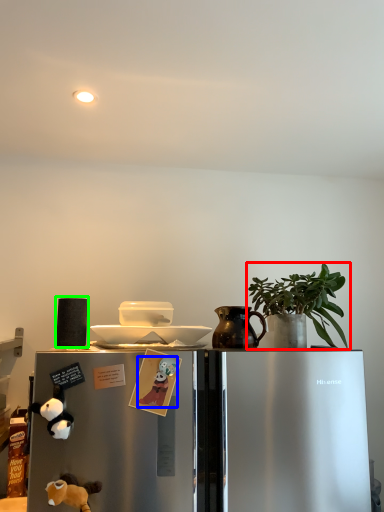
Question: Estimate the real-world distances between objects in this image. Which object is closer to houseplant (highlighted by a red box), animal (highlighted by a blue box) or appliance (highlighted by a green box)?

Choices:
 (A) animal
 (B) appliance

Answer: (A)